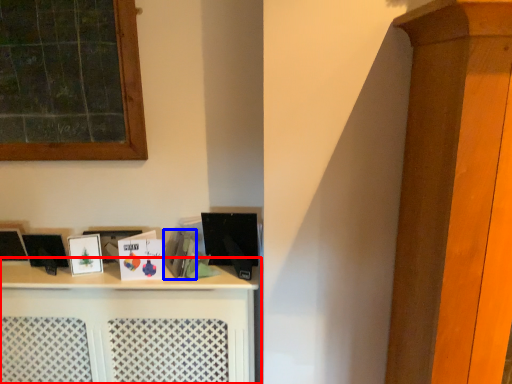
Question: Among these objects, which one is farthest to the camera, shelf (highlighted by a red box) or book (highlighted by a blue box)?

Choices:
 (A) shelf
 (B) book

Answer: (B)